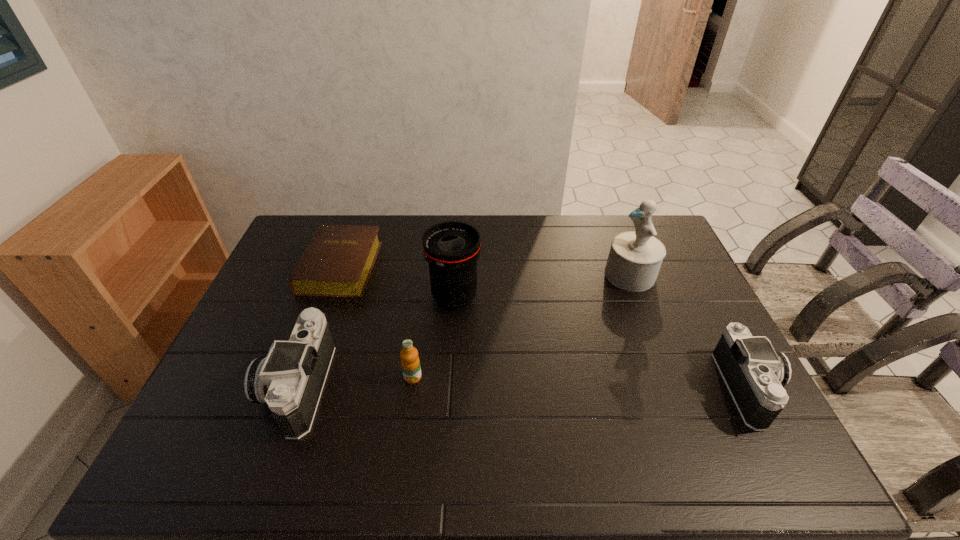
Where is `free spot located on the left of the shorter camera`? This screenshot has width=960, height=540. free spot located on the left of the shorter camera is located at coordinates point(634,388).

Image resolution: width=960 pixels, height=540 pixels. Identify the location of free location located on the right of the Bible. (422, 267).

Where is `free space located 0.300m at the beak of the tallest object`? The height and width of the screenshot is (540, 960). free space located 0.300m at the beak of the tallest object is located at coordinates (515, 275).

Identify the location of free space located 0.180m at the beak of the tallest object. (551, 275).

At what (x,y) coordinates should I click in order to perform the action: click on vacant area situated at the beak of the tallest object. Please return your answer as a coordinate pair (x, y). This screenshot has width=960, height=540. Looking at the image, I should click on (575, 275).

Locate an element on the screen. free space located 0.330m on the left of the second tallest object is located at coordinates (324, 297).

This screenshot has width=960, height=540. Identify the location of free region located on the label of the orange juice. (410, 402).

You are a GUI agent. You are given a task and a screenshot of the screen. Output one action in this format:
    pyautogui.click(x=<x>, y=<y>)
    Task: Click on the object that is at the far edge
    
    Given the screenshot: What is the action you would take?
    pyautogui.click(x=337, y=262)

Identify the location of camera that is at the left edge. (291, 378).

The height and width of the screenshot is (540, 960). What are the coordinates of `Bible located in the left edge section of the desktop` in the screenshot? It's located at (337, 262).